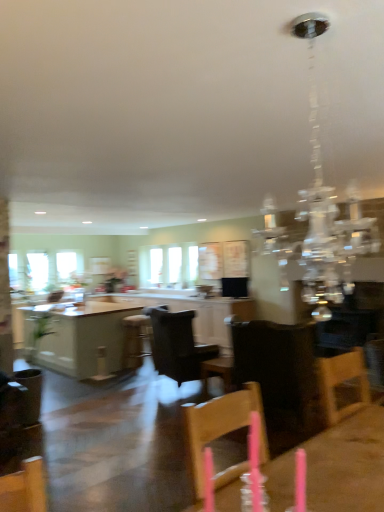
Question: From the image's perspective, is wooden table at center, positioned as the 1th table in front-to-back order, above or below wooden bar stool at center?

Choices:
 (A) below
 (B) above

Answer: (B)

Question: In the image, is wooden table at center, positioned as the 1th table in front-to-back order, positioned in front of or behind wooden bar stool at center?

Choices:
 (A) behind
 (B) front

Answer: (B)

Question: Estimate the real-world distances between objects in this image. Which object is farther from the wooden bar stool at center?

Choices:
 (A) clear crystal chandelier at upper center
 (B) clear glass window at left, positioned as the 1th window in left-to-right order
 (C) dark brown leather chair at center, which is the second chair from back to front
 (D) white glossy table at center, marked as the 1th table in a left-to-right arrangement
 (E) black leather chair at center, the 2th chair positioned from the front

Answer: (C)

Question: Which of these objects is positioned farthest from the black leather chair at center, the 2th chair positioned from the front?

Choices:
 (A) white glossy cabinetry at center
 (B) clear glass window at left, positioned as the 1th window in left-to-right order
 (C) clear crystal chandelier at upper center
 (D) wooden table at center, the second table when ordered from left to right
 (E) clear glass window at center, which appears as the second window when viewed from the left

Answer: (B)